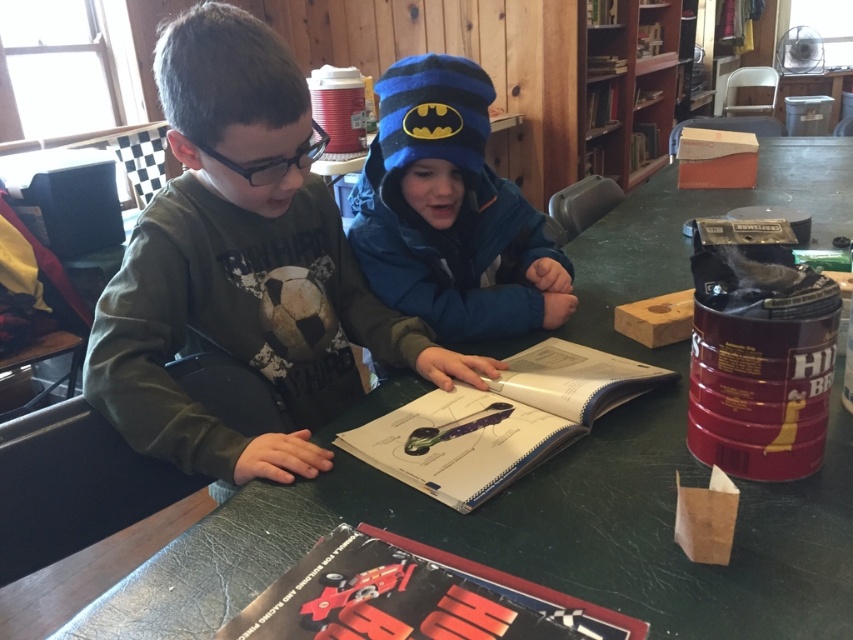
Question: Which object is the closest to the blue fleece jacket at center?

Choices:
 (A) white paper book at center
 (B) wooden bookshelf at upper center
 (C) red glossy book at center
 (D) green matte shirt at left

Answer: (D)

Question: Is green matte shirt at left above white paper book at center?

Choices:
 (A) no
 (B) yes

Answer: (B)

Question: Does green matte shirt at left have a larger size compared to blue fleece jacket at center?

Choices:
 (A) yes
 (B) no

Answer: (A)

Question: Which object is the closest to the blue fleece jacket at center?

Choices:
 (A) wooden bookshelf at upper center
 (B) white paper book at center
 (C) red glossy book at center

Answer: (B)

Question: Can you confirm if blue fleece jacket at center is positioned to the right of red glossy book at center?

Choices:
 (A) yes
 (B) no

Answer: (A)

Question: Considering the real-world distances, which object is farthest from the red glossy book at center?

Choices:
 (A) blue fleece jacket at center
 (B) white paper book at center
 (C) wooden bookshelf at upper center

Answer: (C)